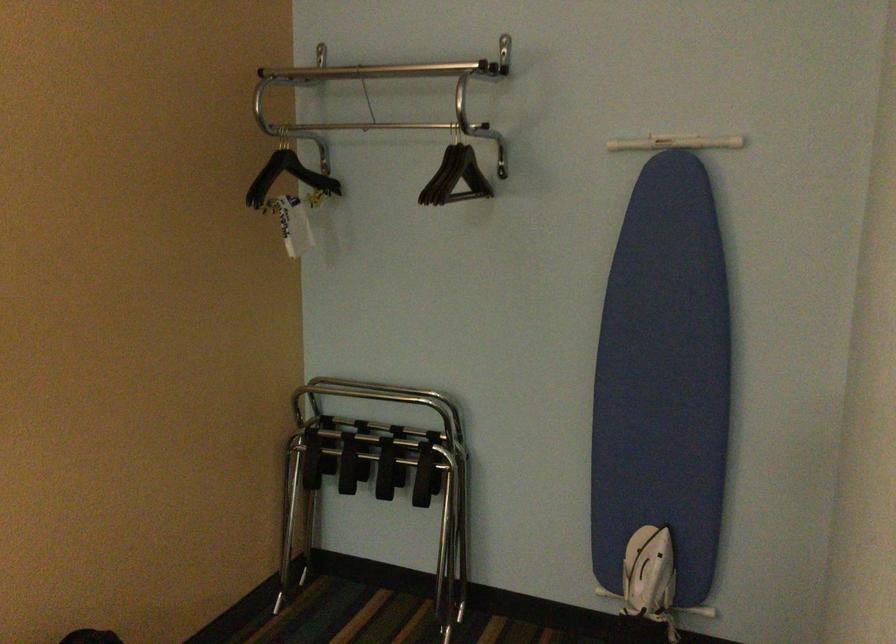
Identify the location of blue ironing board. The width and height of the screenshot is (896, 644). (662, 379).